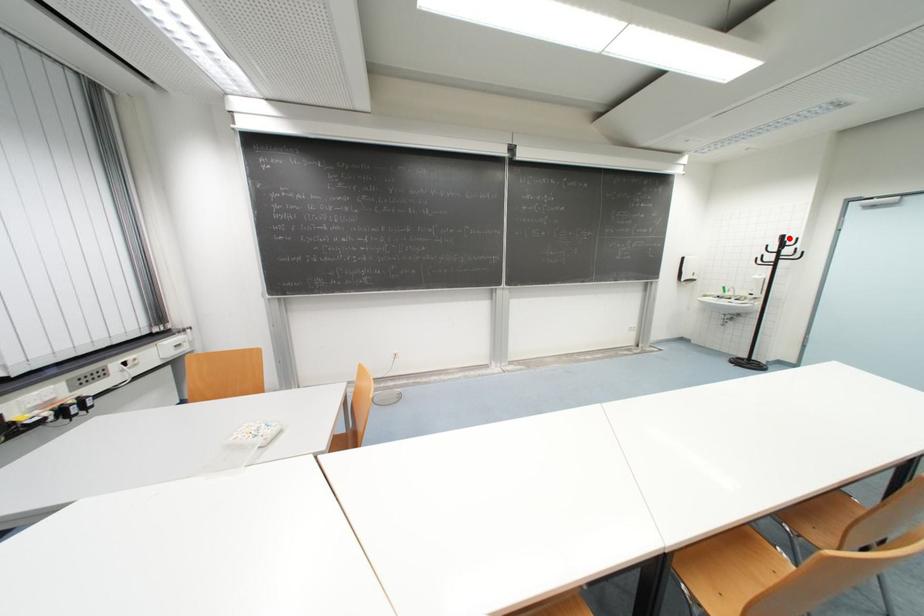
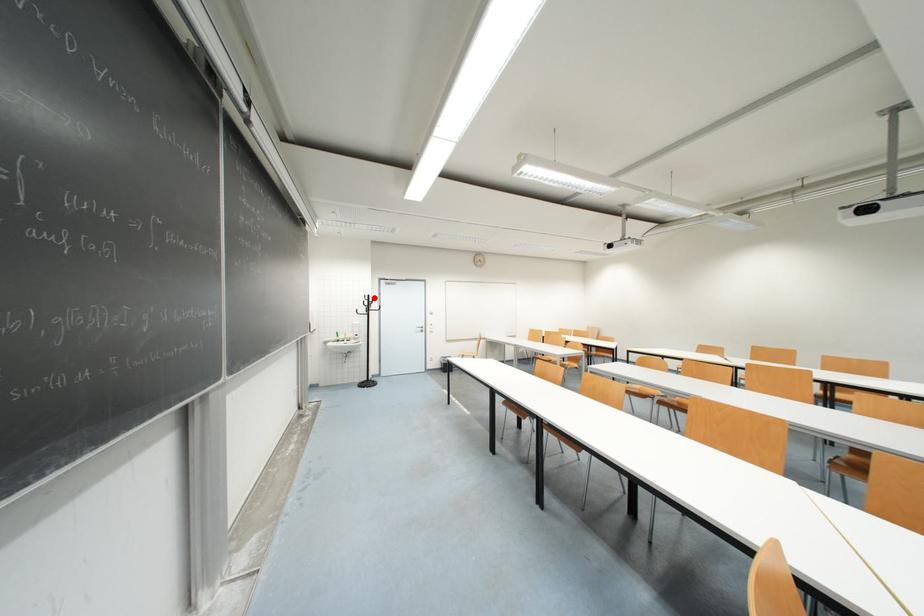
I am providing you with two images of the same scene from different viewpoints. A red point is marked on the first image and another point is marked on the second image. Is the red point in image1 aligned with the point shown in image2?

Yes